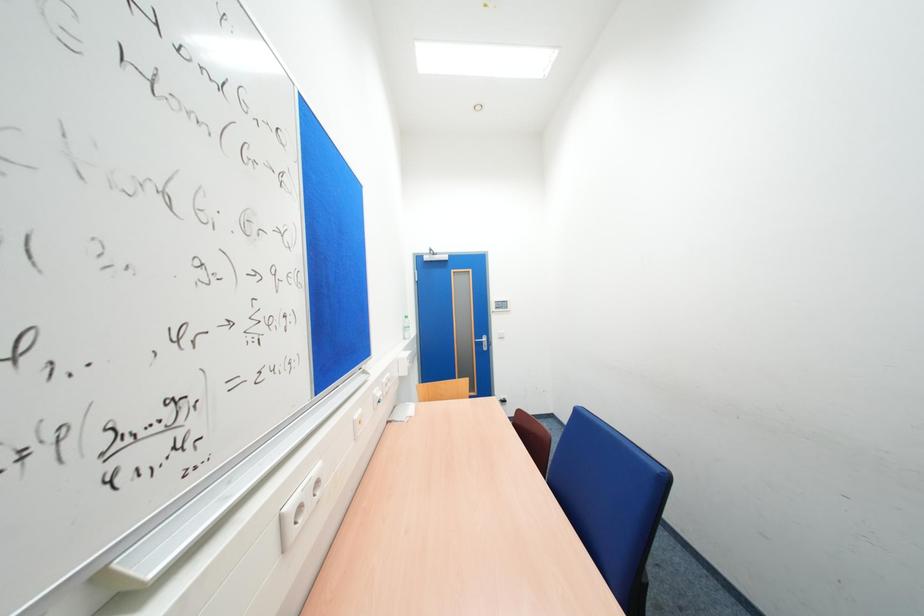
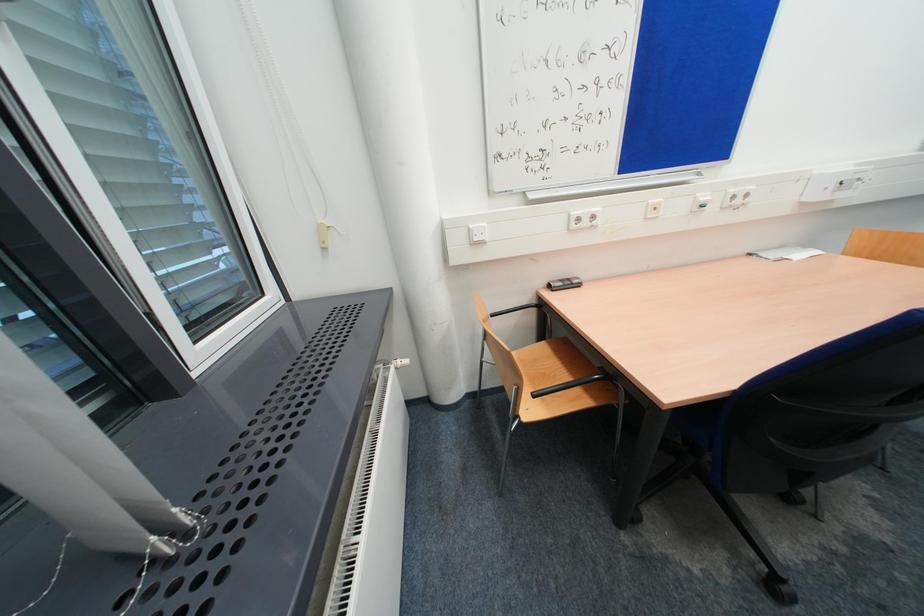
How did the camera likely rotate?

The camera's rotation is toward left-down.